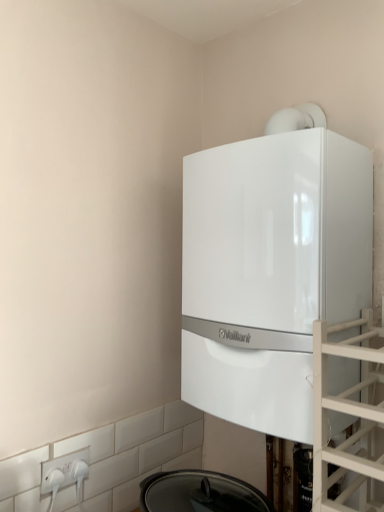
Question: Is transparent glass door at right not close to white glossy boiler at upper center?

Choices:
 (A) no
 (B) yes

Answer: (A)

Question: Does transparent glass door at right have a lesser width compared to white glossy boiler at upper center?

Choices:
 (A) yes
 (B) no

Answer: (B)

Question: Is transparent glass door at right to the left of white glossy boiler at upper center from the viewer's perspective?

Choices:
 (A) no
 (B) yes

Answer: (A)

Question: Is transparent glass door at right at the right side of white glossy boiler at upper center?

Choices:
 (A) yes
 (B) no

Answer: (A)

Question: Can we say transparent glass door at right lies outside white glossy boiler at upper center?

Choices:
 (A) yes
 (B) no

Answer: (A)

Question: Is white glossy boiler at upper center taller or shorter than white plastic electric outlet at lower left?

Choices:
 (A) short
 (B) tall

Answer: (B)

Question: From the image's perspective, is white glossy boiler at upper center above or below white plastic electric outlet at lower left?

Choices:
 (A) above
 (B) below

Answer: (A)

Question: Is white glossy boiler at upper center to the left or to the right of white plastic electric outlet at lower left in the image?

Choices:
 (A) right
 (B) left

Answer: (A)

Question: Is white glossy boiler at upper center in front of or behind white plastic electric outlet at lower left in the image?

Choices:
 (A) front
 (B) behind

Answer: (A)

Question: In terms of size, does white glossy boiler at upper center appear bigger or smaller than transparent glass door at right?

Choices:
 (A) small
 (B) big

Answer: (B)

Question: From their relative heights in the image, would you say white glossy boiler at upper center is taller or shorter than transparent glass door at right?

Choices:
 (A) tall
 (B) short

Answer: (A)

Question: From the image's perspective, is white glossy boiler at upper center above or below transparent glass door at right?

Choices:
 (A) below
 (B) above

Answer: (B)

Question: Looking at their shapes, would you say white glossy boiler at upper center is wider or thinner than transparent glass door at right?

Choices:
 (A) wide
 (B) thin

Answer: (B)

Question: From a real-world perspective, is white plastic electric outlet at lower left positioned above or below white glossy boiler at upper center?

Choices:
 (A) below
 (B) above

Answer: (A)

Question: Considering the relative positions of white plastic electric outlet at lower left and white glossy boiler at upper center in the image provided, is white plastic electric outlet at lower left to the left or to the right of white glossy boiler at upper center?

Choices:
 (A) right
 (B) left

Answer: (B)